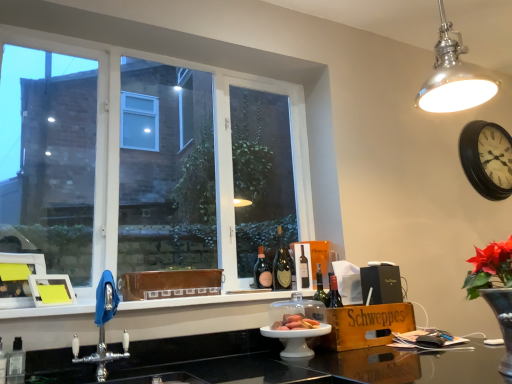
Question: Considering the relative positions of matte glass bottle at center, the 1th bottle in the left-to-right sequence, and matte brown bread at center in the image provided, is matte glass bottle at center, the 1th bottle in the left-to-right sequence, to the left of matte brown bread at center from the viewer's perspective?

Choices:
 (A) yes
 (B) no

Answer: (A)

Question: Can you confirm if matte glass bottle at center, the 1th bottle in the left-to-right sequence, is smaller than matte brown bread at center?

Choices:
 (A) no
 (B) yes

Answer: (A)

Question: Does matte glass bottle at center, the 2th bottle positioned from the right, have a greater height compared to matte brown bread at center?

Choices:
 (A) yes
 (B) no

Answer: (A)

Question: Is matte glass bottle at center, the 1th bottle in the left-to-right sequence, positioned beyond the bounds of matte brown bread at center?

Choices:
 (A) no
 (B) yes

Answer: (B)

Question: Can you confirm if matte glass bottle at center, the 2th bottle positioned from the right, is wider than matte brown bread at center?

Choices:
 (A) yes
 (B) no

Answer: (B)

Question: Is matte glass bottle at center, the 2th bottle positioned from the right, directly adjacent to matte brown bread at center?

Choices:
 (A) no
 (B) yes

Answer: (A)

Question: Can you confirm if polished metal light fixture at upper right is positioned to the left of matte glass bottle at center, the 2th bottle positioned from the right?

Choices:
 (A) no
 (B) yes

Answer: (A)

Question: Is polished metal light fixture at upper right oriented away from matte glass bottle at center, the 1th bottle in the left-to-right sequence?

Choices:
 (A) no
 (B) yes

Answer: (A)

Question: From a real-world perspective, is polished metal light fixture at upper right physically below matte glass bottle at center, the 1th bottle in the left-to-right sequence?

Choices:
 (A) yes
 (B) no

Answer: (B)

Question: Does polished metal light fixture at upper right have a larger size compared to matte glass bottle at center, the 2th bottle positioned from the right?

Choices:
 (A) yes
 (B) no

Answer: (A)

Question: Is polished metal light fixture at upper right wider than matte glass bottle at center, the 1th bottle in the left-to-right sequence?

Choices:
 (A) yes
 (B) no

Answer: (A)

Question: Is polished metal light fixture at upper right not within matte glass bottle at center, the 2th bottle positioned from the right?

Choices:
 (A) yes
 (B) no

Answer: (A)

Question: From a real-world perspective, is chrome metallic tap at lower left positioned under polished metal light fixture at upper right based on gravity?

Choices:
 (A) no
 (B) yes

Answer: (B)